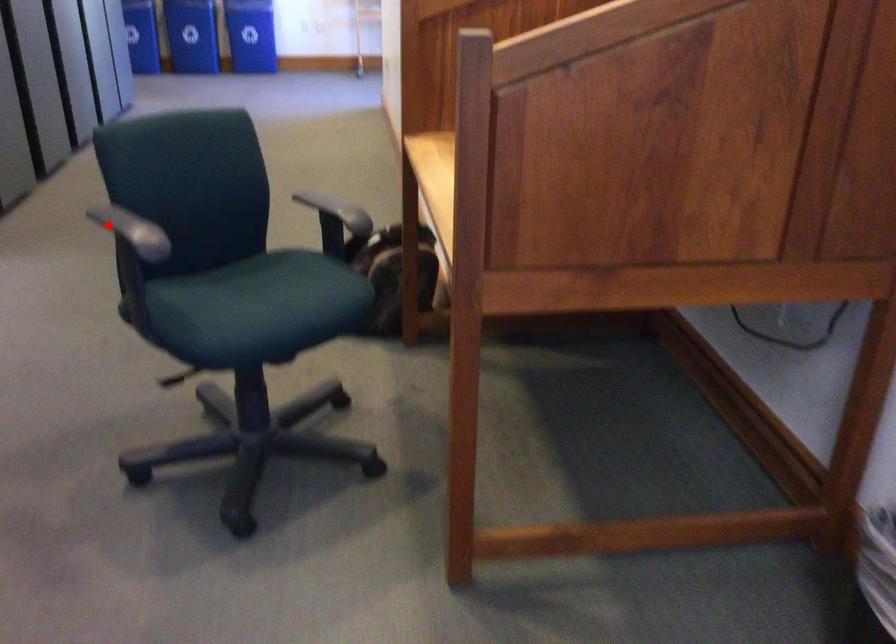
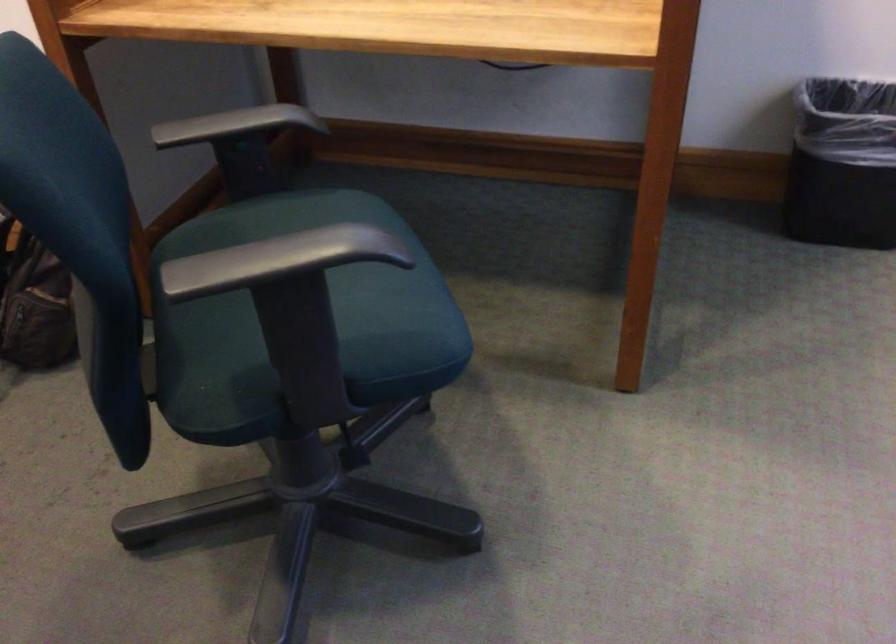
Find the pixel in the second image that matches the highlighted location in the first image.

(250, 265)